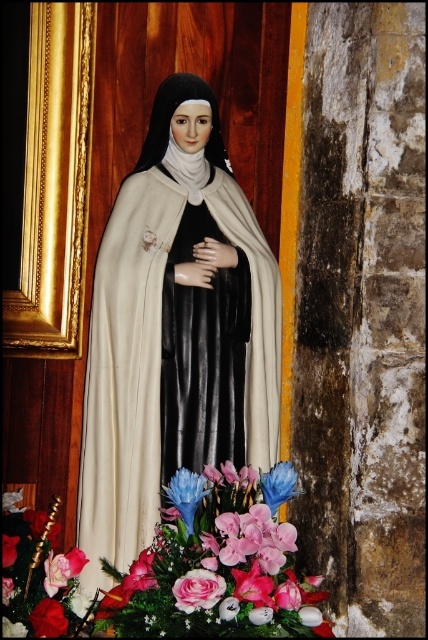
You are standing in front of the statue of the nun. There is a point at coordinate (121, 516). Can you reach it without moving your feet?

The point at coordinate (121, 516) is 8.95 feet away from you, so you cannot reach it without moving your feet.

You are standing in front of the statue of the nun and notice two points marked on the statue. The first point is at coordinates point (x=193, y=538) and the second point is at point (x=193, y=474). Which of these two points is closer to you?

Point (x=193, y=538) is closer to the viewer than point (x=193, y=474).